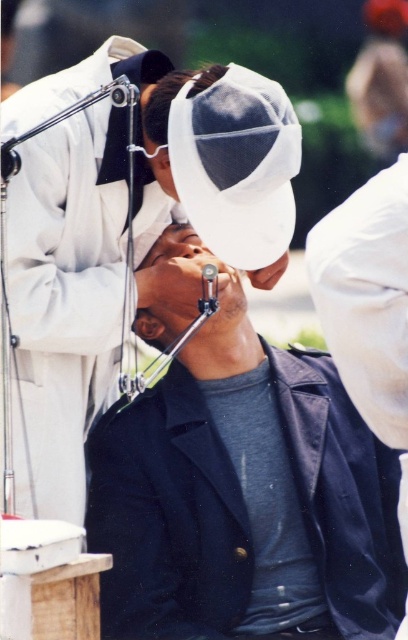
Question: Which point appears closest to the camera in this image?

Choices:
 (A) (153, 132)
 (B) (90, 268)

Answer: (A)

Question: Is dark blue fabric jacket at center above white mesh cap at upper center?

Choices:
 (A) yes
 (B) no

Answer: (B)

Question: Is dark blue fabric jacket at center above matte black jacket at center?

Choices:
 (A) yes
 (B) no

Answer: (B)

Question: Among these points, which one is farthest from the camera?

Choices:
 (A) (232, 330)
 (B) (159, 99)

Answer: (A)

Question: Which point is closer to the camera?

Choices:
 (A) (106, 221)
 (B) (197, 88)

Answer: (B)

Question: Does dark blue fabric jacket at center come in front of white mesh cap at upper center?

Choices:
 (A) no
 (B) yes

Answer: (A)